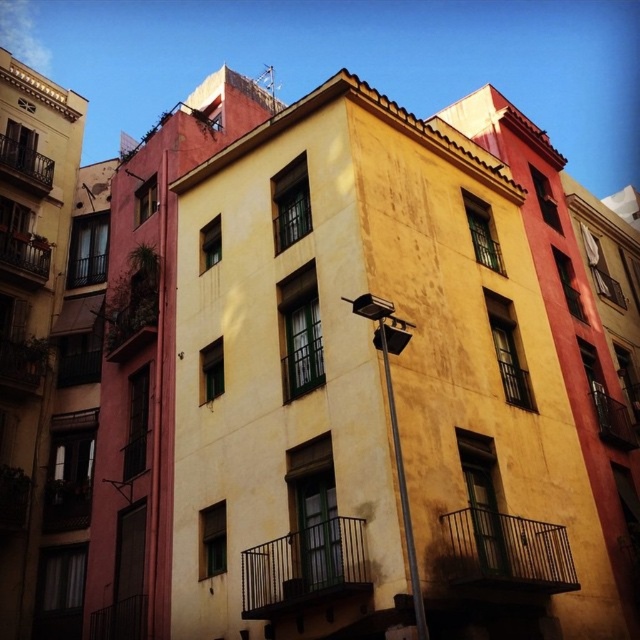
You are a painter standing on the ground in front of the building. You need to paint both the green metal balcony at center and the metallic black balcony at right. Which balcony will require you to reach higher to paint its top edge?

The green metal balcony at center is taller than the metallic black balcony at right, so you will need to reach higher to paint the top edge of the green metal balcony at center.

You are a painter planning to paint both the green metal balcony at center and the rustic wood balcony at left. If you need to estimate the amount of paint required, which balcony would require more paint due to its larger size?

The green metal balcony at center requires more paint because its width surpasses that of the rustic wood balcony at left.

Looking at this image, you are standing in front of the building and want to hang a banner from the metallic pole at center. Is the metallic black balcony at lower right directly below the pole?

Yes, the metallic black balcony at lower right is positioned under the metallic pole at center, so the balcony is directly below the pole.